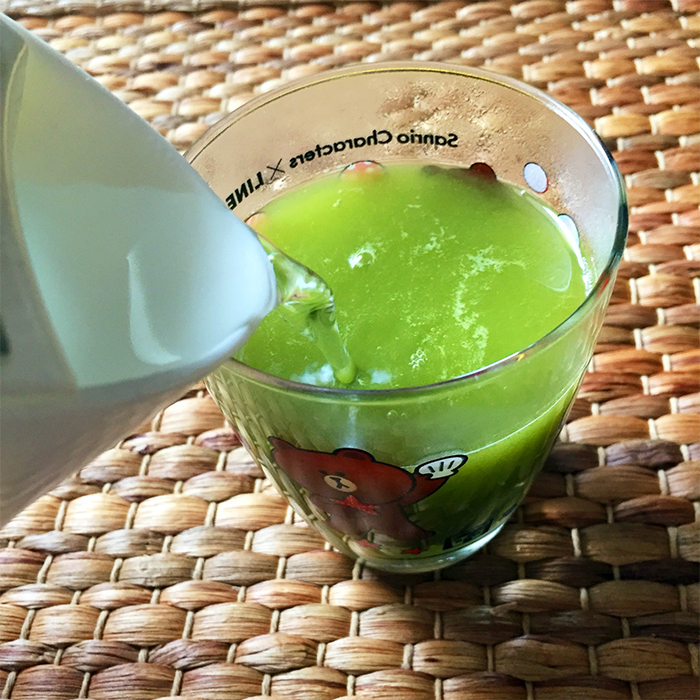
Image resolution: width=700 pixels, height=700 pixels. In order to click on shadow from cup in this screenshot , I will do `click(594, 596)`.